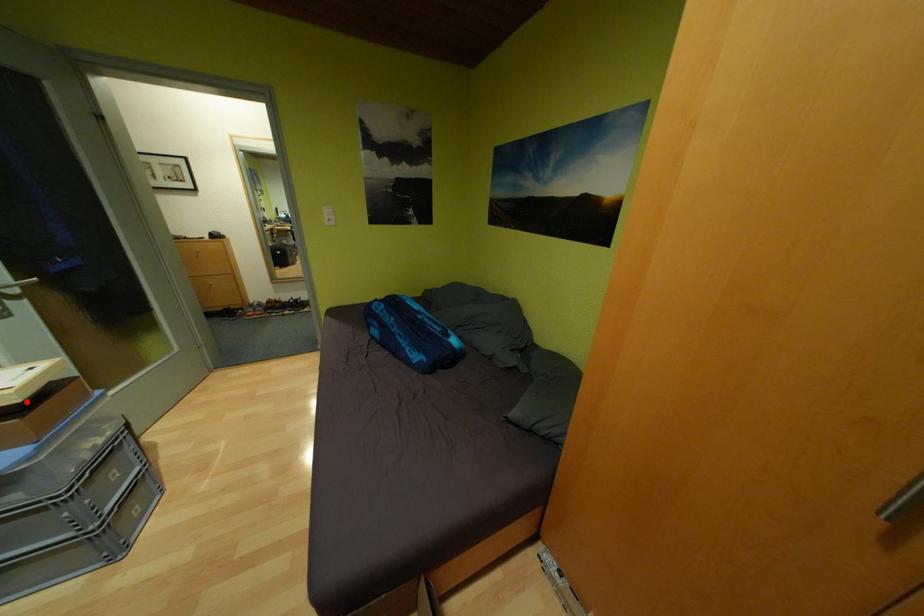
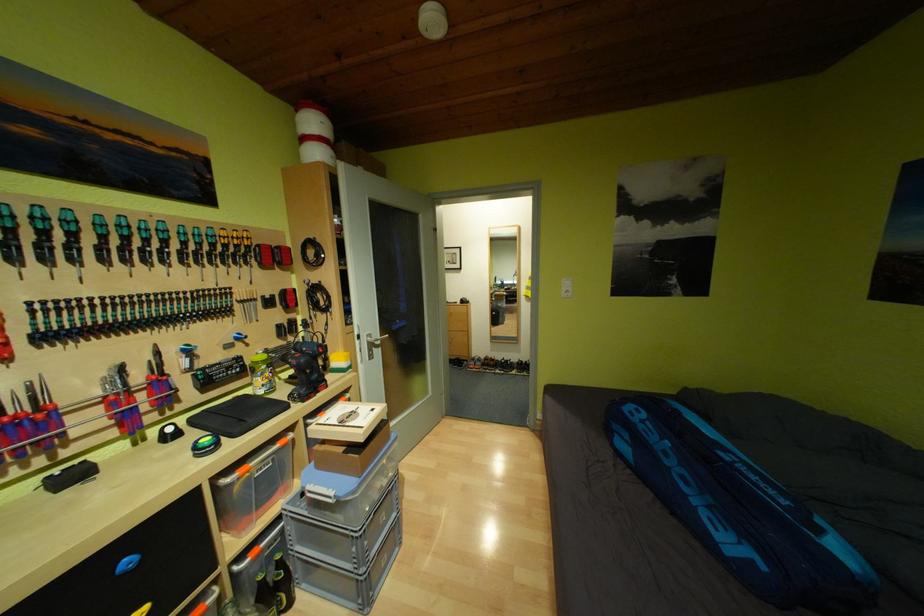
Locate, in the second image, the point that corresponds to the highlighted location in the first image.

(371, 440)